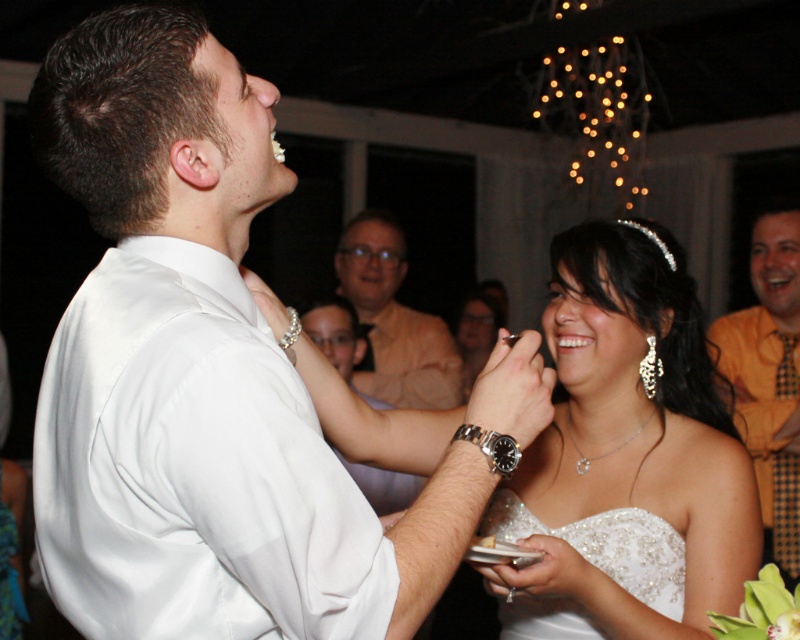
Which is in front, point (756, 310) or point (408, 362)?

Point (756, 310) is in front.

In the scene shown: Does orange textured shirt at right have a greater height compared to matte beige shirt at center?

Correct, orange textured shirt at right is much taller as matte beige shirt at center.

Who is more forward, (722,339) or (380,339)?

Positioned in front is point (722,339).

Where is `orange textured shirt at right`? This screenshot has width=800, height=640. orange textured shirt at right is located at coordinates (770, 372).

Is white satin dress at center wider than matte beige shirt at center?

Correct, the width of white satin dress at center exceeds that of matte beige shirt at center.

Does point (314, 628) come closer to viewer compared to point (384, 266)?

That is True.

You are a GUI agent. You are given a task and a screenshot of the screen. Output one action in this format:
    pyautogui.click(x=<x>, y=<y>)
    Task: Click on the white satin dress at center
    This screenshot has height=640, width=800.
    Given the screenshot: What is the action you would take?
    pyautogui.click(x=214, y=376)

Is point (224, 314) in front of point (660, 227)?

Yes, it is.

Is point (142, 132) positioned after point (638, 547)?

No, it is not.

Which is behind, point (148, 168) or point (724, 404)?

The point (724, 404) is behind.

Where is `white satin dress at center`? The image size is (800, 640). white satin dress at center is located at coordinates [x=214, y=376].